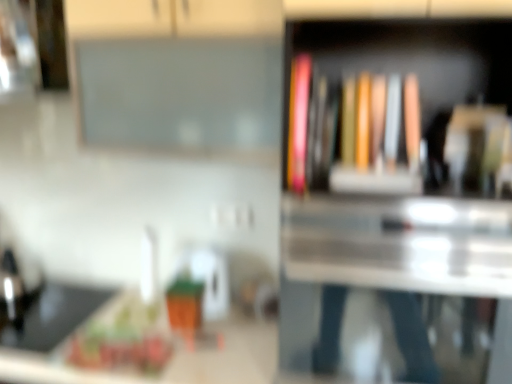
Question: Is wooden bookshelf at center to the right of matte pink book at upper right, the second book viewed from the right, from the viewer's perspective?

Choices:
 (A) yes
 (B) no

Answer: (A)

Question: From a real-world perspective, is wooden bookshelf at center positioned over matte pink book at upper right, the first book from the left, based on gravity?

Choices:
 (A) yes
 (B) no

Answer: (B)

Question: Does wooden bookshelf at center come in front of matte pink book at upper right, the second book viewed from the right?

Choices:
 (A) no
 (B) yes

Answer: (B)

Question: Is wooden bookshelf at center outside of matte pink book at upper right, the first book from the left?

Choices:
 (A) no
 (B) yes

Answer: (B)

Question: Would you say wooden bookshelf at center contains matte pink book at upper right, the second book viewed from the right?

Choices:
 (A) yes
 (B) no

Answer: (A)

Question: Can you confirm if wooden bookshelf at center is thinner than matte pink book at upper right, the second book viewed from the right?

Choices:
 (A) yes
 (B) no

Answer: (B)

Question: Is white glossy counter top at lower left outside black matte sink at lower left?

Choices:
 (A) no
 (B) yes

Answer: (B)

Question: Is white glossy counter top at lower left further to camera compared to black matte sink at lower left?

Choices:
 (A) no
 (B) yes

Answer: (A)

Question: Considering the relative positions of white glossy counter top at lower left and black matte sink at lower left in the image provided, is white glossy counter top at lower left to the left of black matte sink at lower left from the viewer's perspective?

Choices:
 (A) yes
 (B) no

Answer: (B)

Question: Considering the relative sizes of white glossy counter top at lower left and black matte sink at lower left in the image provided, is white glossy counter top at lower left thinner than black matte sink at lower left?

Choices:
 (A) no
 (B) yes

Answer: (A)

Question: From the image's perspective, is white glossy counter top at lower left beneath black matte sink at lower left?

Choices:
 (A) yes
 (B) no

Answer: (A)

Question: Does white glossy counter top at lower left have a smaller size compared to black matte sink at lower left?

Choices:
 (A) no
 (B) yes

Answer: (A)

Question: Is the depth of white glossy counter top at lower left greater than that of matte hardcover book at center, positioned as the first book in right-to-left order?

Choices:
 (A) yes
 (B) no

Answer: (A)